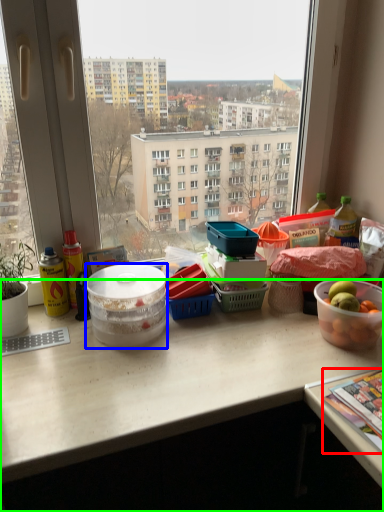
Question: Based on their relative distances, which object is farther from magazine (highlighted by a red box)? Choose from bowl (highlighted by a blue box) and desk (highlighted by a green box).

Choices:
 (A) bowl
 (B) desk

Answer: (A)